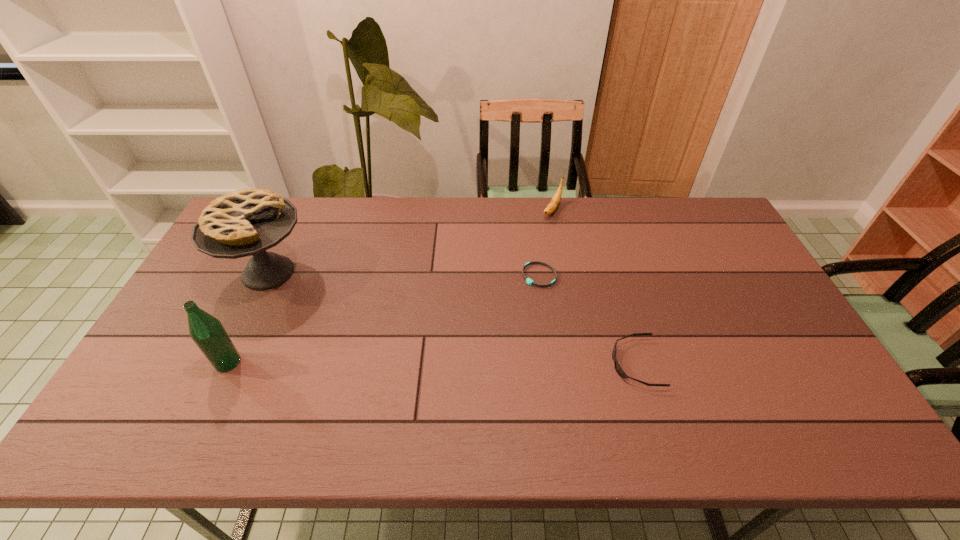
You are a GUI agent. You are given a task and a screenshot of the screen. Output one action in this format:
    pyautogui.click(x=<x>, y=<y>)
    Task: Click on the bottle
    Image resolution: width=960 pixels, height=540 pixels.
    Given the screenshot: What is the action you would take?
    pyautogui.click(x=207, y=332)

Where is `sunglasses`? sunglasses is located at coordinates (619, 370).

Locate an element on the screen. the rightmost object is located at coordinates (619, 370).

Where is `the shortest object`? the shortest object is located at coordinates (530, 282).

The height and width of the screenshot is (540, 960). I want to click on the third shortest object, so click(x=554, y=203).

The width and height of the screenshot is (960, 540). I want to click on the farthest object, so click(554, 203).

Where is `pie`? The width and height of the screenshot is (960, 540). pie is located at coordinates (247, 222).

Locate an element on the screen. This screenshot has height=540, width=960. vacant region located 0.220m on the right of the bottle is located at coordinates (326, 362).

This screenshot has height=540, width=960. What are the coordinates of `free region located on the front-facing side of the rightmost object` in the screenshot? It's located at (504, 363).

This screenshot has width=960, height=540. Find the location of `free space located on the front-facing side of the rightmost object`. free space located on the front-facing side of the rightmost object is located at coordinates (457, 363).